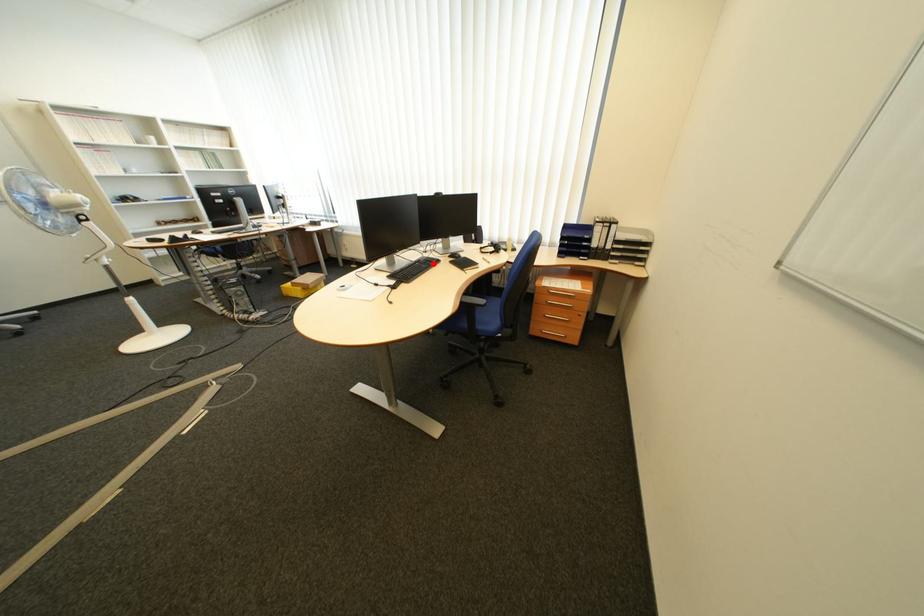
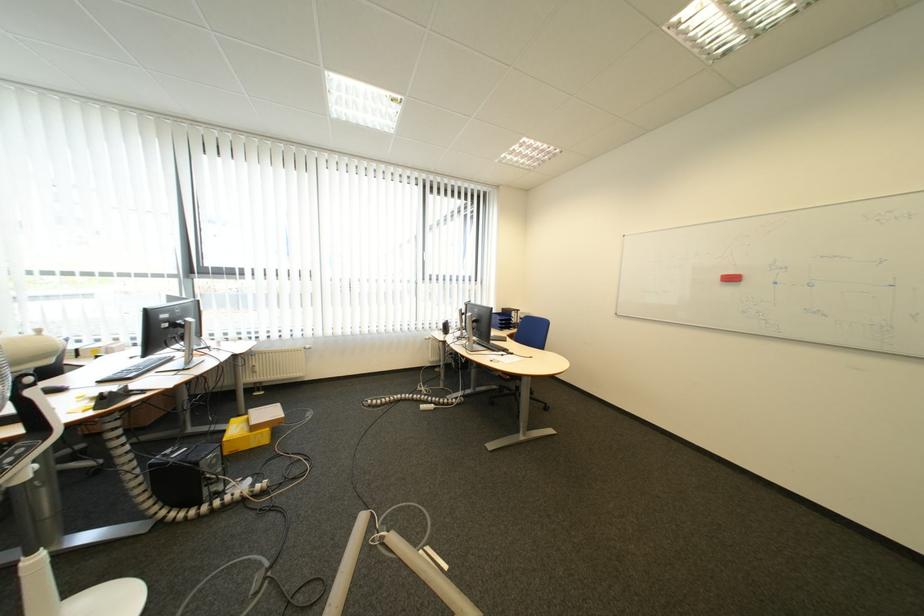
Question: I am providing you with two images of the same scene from different viewpoints. A red point is marked on the first image. Is the red point's position out of view in image 2?

Choices:
 (A) Yes
 (B) No

Answer: (A)